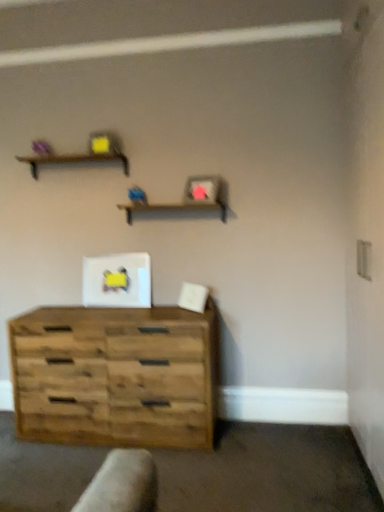
Question: Does wooden shelf at center, which is counted as the 1th shelf, starting from the right, lie in front of rustic wood chest of drawers at lower left?

Choices:
 (A) no
 (B) yes

Answer: (A)

Question: From the image's perspective, is wooden shelf at center, which is counted as the 1th shelf, starting from the bottom, located above rustic wood chest of drawers at lower left?

Choices:
 (A) yes
 (B) no

Answer: (A)

Question: Is the surface of wooden shelf at center, which is counted as the 1th shelf, starting from the right, in direct contact with rustic wood chest of drawers at lower left?

Choices:
 (A) no
 (B) yes

Answer: (A)

Question: Is the depth of wooden shelf at center, which is counted as the 1th shelf, starting from the right, greater than that of rustic wood chest of drawers at lower left?

Choices:
 (A) yes
 (B) no

Answer: (A)

Question: From a real-world perspective, is wooden shelf at center, which is counted as the 1th shelf, starting from the bottom, over rustic wood chest of drawers at lower left?

Choices:
 (A) no
 (B) yes

Answer: (B)

Question: Considering the positions of wooden shelf at center, which is counted as the 1th shelf, starting from the right, and rustic wood chest of drawers at lower left in the image, is wooden shelf at center, which is counted as the 1th shelf, starting from the right, bigger or smaller than rustic wood chest of drawers at lower left?

Choices:
 (A) big
 (B) small

Answer: (B)

Question: From the image's perspective, is wooden shelf at center, which appears as the 2th shelf when viewed from the left, above or below rustic wood chest of drawers at lower left?

Choices:
 (A) above
 (B) below

Answer: (A)

Question: Is wooden shelf at center, acting as the second shelf starting from the top, inside the boundaries of rustic wood chest of drawers at lower left, or outside?

Choices:
 (A) inside
 (B) outside

Answer: (B)

Question: Considering their positions, is wooden shelf at center, which is counted as the 1th shelf, starting from the bottom, located in front of or behind rustic wood chest of drawers at lower left?

Choices:
 (A) front
 (B) behind

Answer: (B)

Question: From a real-world perspective, relative to brown wooden shelf at upper center, the 2th shelf from the right, is rustic wood chest of drawers at lower left vertically above or below?

Choices:
 (A) above
 (B) below

Answer: (B)

Question: From their relative heights in the image, would you say rustic wood chest of drawers at lower left is taller or shorter than brown wooden shelf at upper center, the 2th shelf from the right?

Choices:
 (A) short
 (B) tall

Answer: (B)

Question: Is rustic wood chest of drawers at lower left in front of or behind brown wooden shelf at upper center, the 1th shelf viewed from the left, in the image?

Choices:
 (A) front
 (B) behind

Answer: (A)

Question: Which is correct: rustic wood chest of drawers at lower left is inside brown wooden shelf at upper center, the 2th shelf from the right, or outside of it?

Choices:
 (A) inside
 (B) outside

Answer: (B)

Question: From the image's perspective, relative to brown wooden shelf at upper center, the 1th shelf viewed from the left, is wooden shelf at center, acting as the second shelf starting from the top, above or below?

Choices:
 (A) above
 (B) below

Answer: (B)

Question: Considering the relative positions of wooden shelf at center, acting as the second shelf starting from the top, and brown wooden shelf at upper center, the 2th shelf ordered from the bottom, in the image provided, is wooden shelf at center, acting as the second shelf starting from the top, to the left or to the right of brown wooden shelf at upper center, the 2th shelf ordered from the bottom,?

Choices:
 (A) left
 (B) right

Answer: (B)